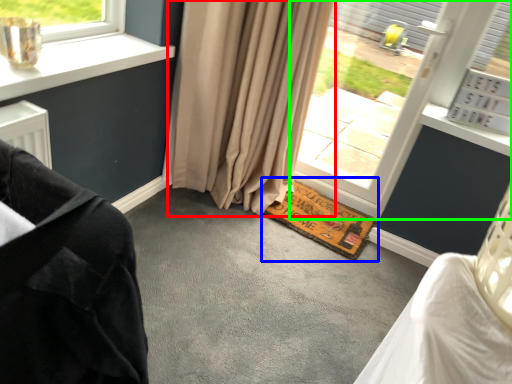
Question: Based on their relative distances, which object is farther from curtain (highlighted by a red box)? Choose from doormat (highlighted by a blue box) and window (highlighted by a green box).

Choices:
 (A) doormat
 (B) window

Answer: (B)